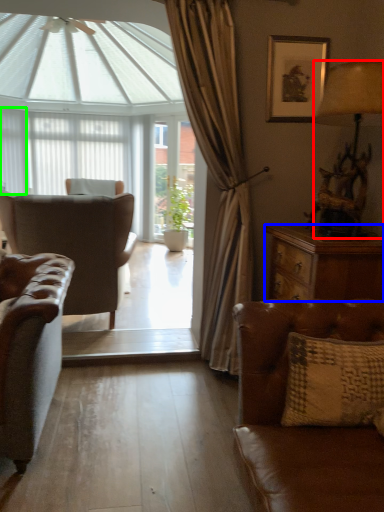
Question: Which object is positioned closest to lamp (highlighted by a red box)? Select from desk (highlighted by a blue box) and shutter (highlighted by a green box).

Choices:
 (A) desk
 (B) shutter

Answer: (A)